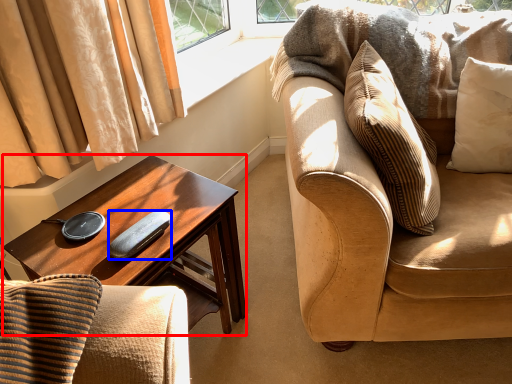
Question: Among these objects, which one is farthest to the camera, desk (highlighted by a red box) or remote control (highlighted by a blue box)?

Choices:
 (A) desk
 (B) remote control

Answer: (B)